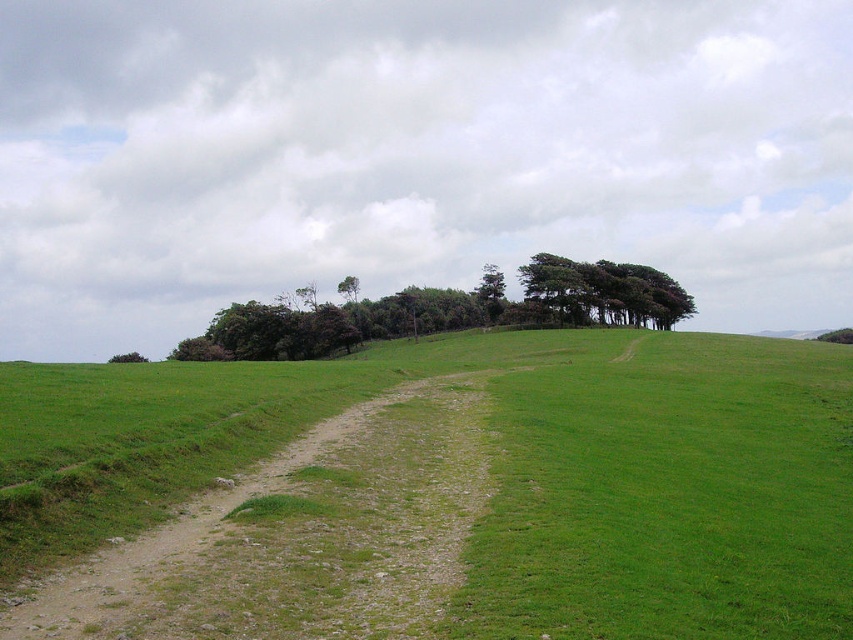
Who is taller, dark green textured trees at upper center or green leafy tree at center?

Standing taller between the two is dark green textured trees at upper center.

Identify the location of dark green textured trees at upper center. The image size is (853, 640). (604, 291).

Where is `dark green textured trees at upper center`? This screenshot has height=640, width=853. dark green textured trees at upper center is located at coordinates (604, 291).

Does green grassy at center have a greater width compared to green leafy tree at right?

No, green grassy at center is not wider than green leafy tree at right.

Is green grassy at center further to the viewer compared to green leafy tree at right?

No, green grassy at center is closer to the viewer.

Identify the location of green grassy at center. The width and height of the screenshot is (853, 640). [466, 486].

Who is taller, green grassy at center or dark green textured trees at upper center?

With more height is dark green textured trees at upper center.

Does green grassy at center have a larger size compared to dark green textured trees at upper center?

No, green grassy at center is not bigger than dark green textured trees at upper center.

Who is more distant from viewer, (241, 371) or (590, 284)?

Positioned behind is point (590, 284).

What are the coordinates of `green grassy at center` in the screenshot? It's located at (x=466, y=486).